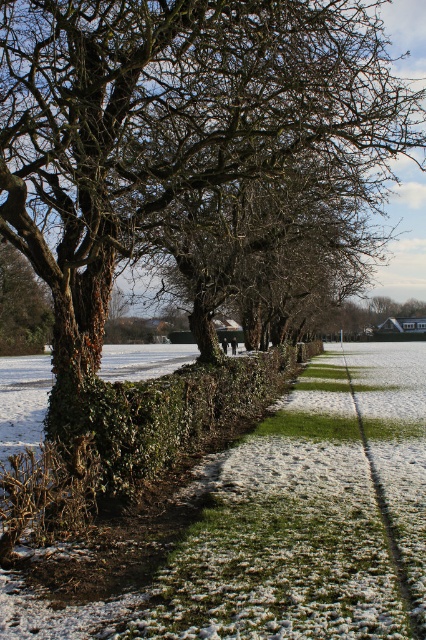
Consider the image. Is green leafy tree at upper left bigger than green grass at center?

Yes, green leafy tree at upper left is bigger than green grass at center.

Does point (19, 257) come in front of point (296, 426)?

That is False.

Where is `green leafy tree at upper left`? green leafy tree at upper left is located at coordinates (22, 305).

Is green leafy hedge at center in front of green grass at center?

Yes, green leafy hedge at center is closer to the viewer.

Which is in front, point (118, 461) or point (302, 424)?

Point (118, 461) is in front.

Image resolution: width=426 pixels, height=640 pixels. What are the coordinates of `green leafy hedge at center` in the screenshot? It's located at (129, 438).

From the picture: Is green leafy hedge at center taller than green leafy tree at upper left?

No, green leafy hedge at center is not taller than green leafy tree at upper left.

Does green leafy hedge at center have a greater width compared to green leafy tree at upper left?

Yes.

Who is more forward, (86, 400) or (43, 326)?

Positioned in front is point (86, 400).

The height and width of the screenshot is (640, 426). Find the location of `green leafy hedge at center`. green leafy hedge at center is located at coordinates (129, 438).